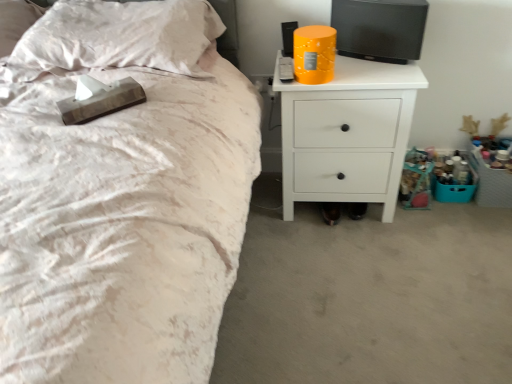
Question: Considering the positions of white satin pillow at upper left and white matte nightstand at upper right in the image, is white satin pillow at upper left bigger or smaller than white matte nightstand at upper right?

Choices:
 (A) big
 (B) small

Answer: (B)

Question: Is white satin pillow at upper left wider or thinner than white matte nightstand at upper right?

Choices:
 (A) thin
 (B) wide

Answer: (B)

Question: Is point (120, 44) closer or farther from the camera than point (379, 142)?

Choices:
 (A) closer
 (B) farther

Answer: (A)

Question: Looking at their shapes, would you say white matte nightstand at upper right is wider or thinner than white satin pillow at upper left?

Choices:
 (A) wide
 (B) thin

Answer: (B)

Question: Relative to white satin pillow at upper left, is white matte nightstand at upper right in front or behind?

Choices:
 (A) front
 (B) behind

Answer: (B)

Question: From the image's perspective, is white matte nightstand at upper right positioned above or below white satin pillow at upper left?

Choices:
 (A) below
 (B) above

Answer: (A)

Question: From a real-world perspective, relative to white satin pillow at upper left, is white matte nightstand at upper right vertically above or below?

Choices:
 (A) below
 (B) above

Answer: (A)